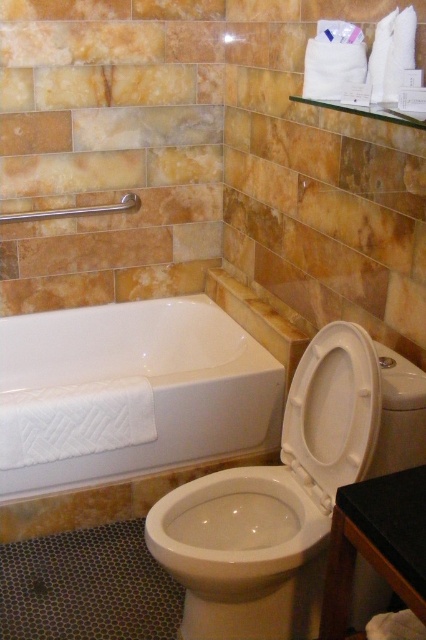
Question: Which point is closer to the camera?

Choices:
 (A) brushed metal towel bar at upper left
 (B) white glossy bathtub at lower left
 (C) white glossy toilet at lower right

Answer: (C)

Question: Estimate the real-world distances between objects in this image. Which object is farther from the white glossy toilet bowl at center?

Choices:
 (A) white plastic toilet seat at center
 (B) white glossy bathtub at lower left
 (C) brushed metal towel bar at upper left
 (D) white glossy toilet at lower right

Answer: (C)

Question: Is white glossy toilet bowl at center further to camera compared to white plastic toilet seat at center?

Choices:
 (A) no
 (B) yes

Answer: (B)

Question: Which of these objects is positioned closest to the white glossy toilet bowl at center?

Choices:
 (A) white plastic toilet seat at center
 (B) white glossy bathtub at lower left
 (C) brushed metal towel bar at upper left
 (D) white glossy toilet at lower right

Answer: (D)

Question: Is white glossy toilet at lower right below white glossy toilet bowl at center?

Choices:
 (A) no
 (B) yes

Answer: (A)

Question: Is white glossy toilet bowl at center to the right of brushed metal towel bar at upper left from the viewer's perspective?

Choices:
 (A) yes
 (B) no

Answer: (A)